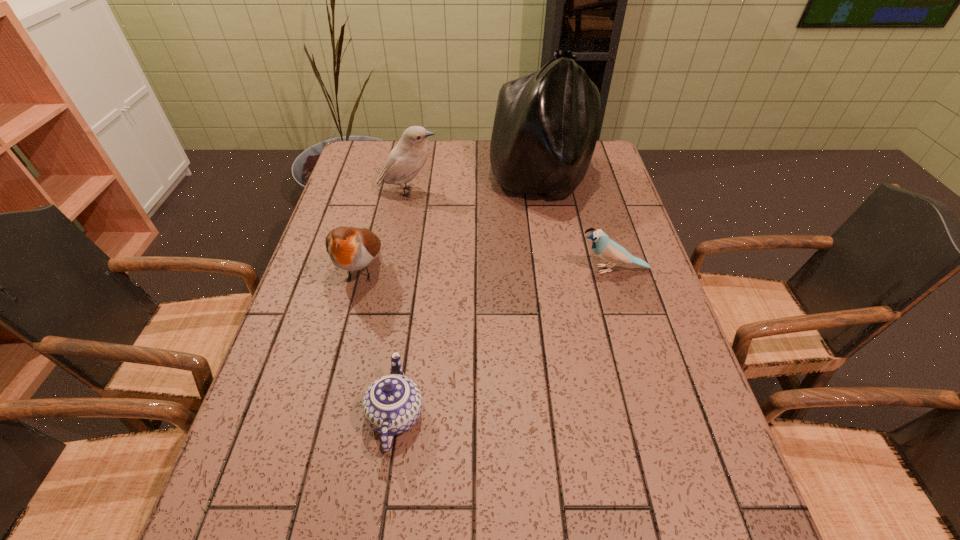
Find the location of a particular element. free region located 0.110m at the face of the rightmost bird is located at coordinates (536, 269).

Identify the location of vacant space located 0.270m at the face of the rightmost bird. (475, 269).

Where is `free space located at the face of the rightmost bird`? Image resolution: width=960 pixels, height=540 pixels. free space located at the face of the rightmost bird is located at coordinates (520, 269).

The image size is (960, 540). Find the location of `vacant space located at the spout of the nearest object`. vacant space located at the spout of the nearest object is located at coordinates (413, 298).

At what (x,y) coordinates should I click in order to perform the action: click on free space located 0.400m at the spout of the nearest object. Please return your answer as a coordinate pair (x, y). Looking at the image, I should click on (420, 249).

I want to click on free space located at the spout of the nearest object, so click(408, 329).

In order to click on object located at the far edge in this screenshot , I will do `click(546, 124)`.

Find the location of a particular element. The image size is (960, 540). plastic bag that is at the right edge is located at coordinates 546,124.

Locate an element on the screen. bird at the right edge is located at coordinates (608, 250).

Locate an element on the screen. The image size is (960, 540). object that is at the far right corner is located at coordinates (546, 124).